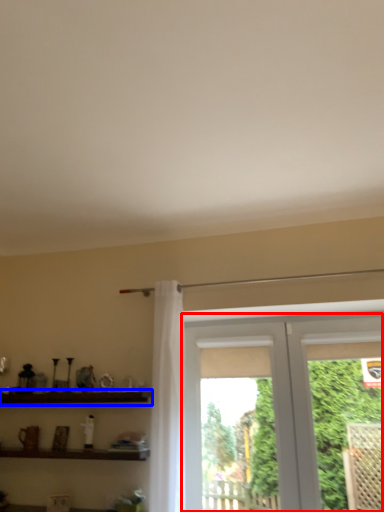
Question: Which point is closer to the camera, window (highlighted by a red box) or shelf (highlighted by a blue box)?

Choices:
 (A) window
 (B) shelf

Answer: (A)